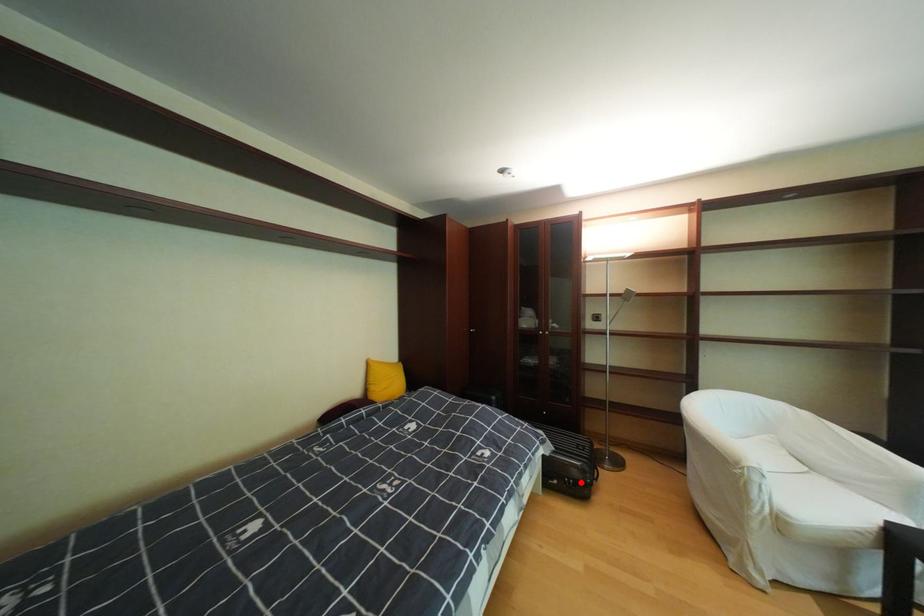
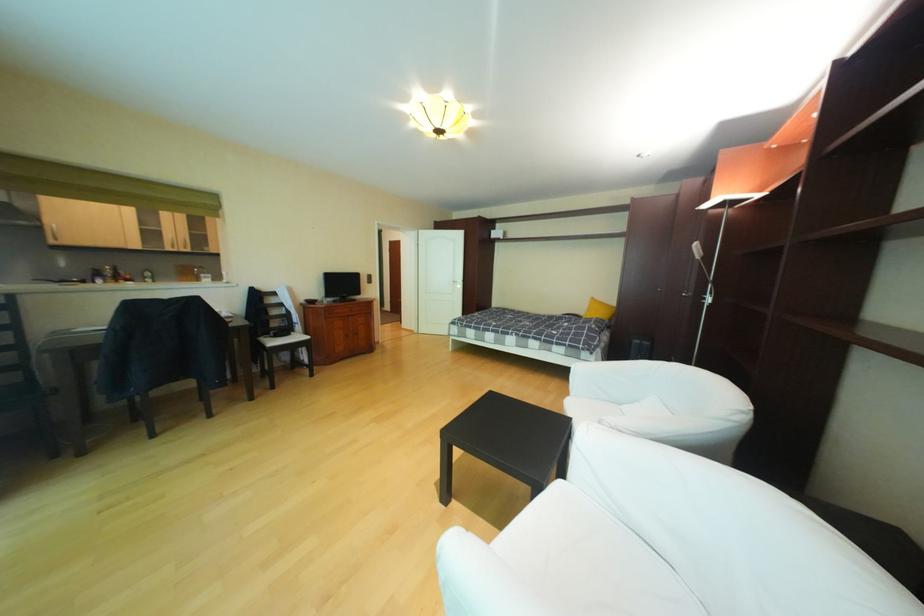
Question: I am providing you with two images of the same scene from different viewpoints. A red point is marked on the first image. Can you still see the location of the red point in image 2?

Choices:
 (A) Yes
 (B) No

Answer: (B)